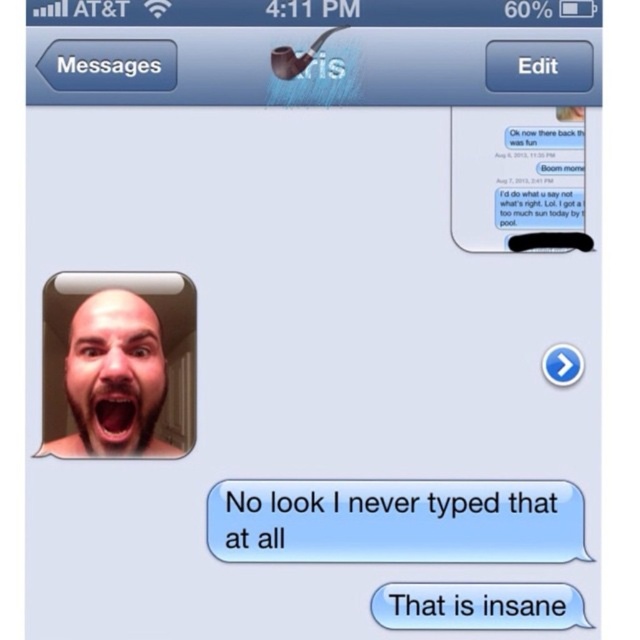
Question: Based on their relative distances, which object is farther from the blue glossy text bubble at center?

Choices:
 (A) bald head at upper left
 (B) white paper text message at center

Answer: (A)

Question: Is white paper text message at center positioned in front of bald head at upper left?

Choices:
 (A) yes
 (B) no

Answer: (A)

Question: Does white paper text message at center have a larger size compared to blue glossy text bubble at center?

Choices:
 (A) no
 (B) yes

Answer: (B)

Question: Is white paper text message at center positioned behind bald head at upper left?

Choices:
 (A) no
 (B) yes

Answer: (A)

Question: Which point appears farthest from the camera in this image?

Choices:
 (A) (390, 627)
 (B) (77, 308)

Answer: (B)

Question: Among these points, which one is nearest to the camera?

Choices:
 (A) (436, 586)
 (B) (577, 550)
 (C) (81, 323)

Answer: (B)